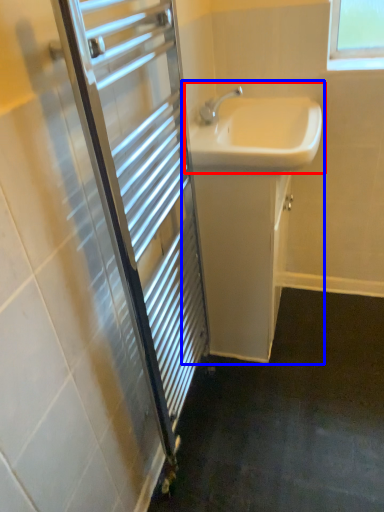
Question: Among these objects, which one is nearest to the camera, sink (highlighted by a red box) or bathroom cabinet (highlighted by a blue box)?

Choices:
 (A) sink
 (B) bathroom cabinet

Answer: (A)